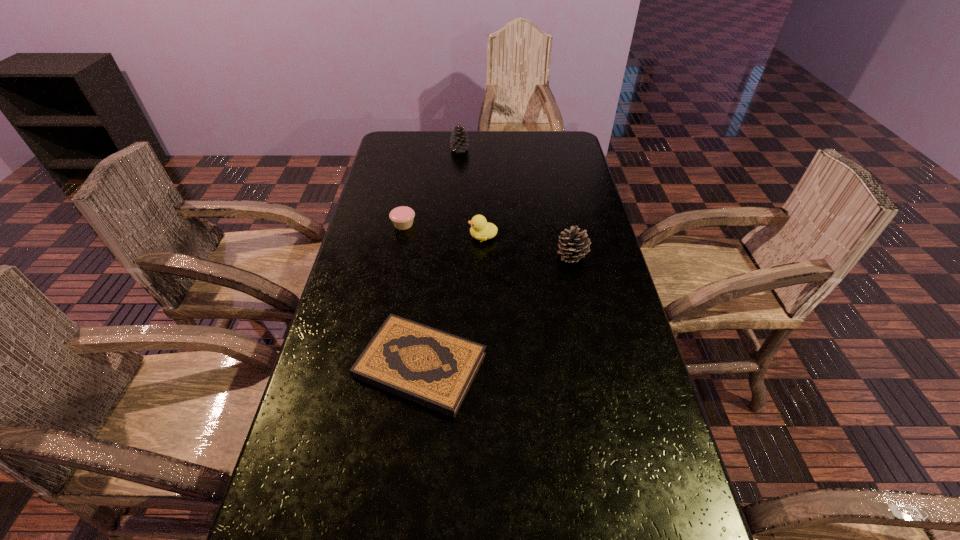
Locate an element on the screen. The height and width of the screenshot is (540, 960). the farthest object is located at coordinates (458, 143).

This screenshot has width=960, height=540. In order to click on the left pinecone in this screenshot , I will do `click(458, 143)`.

This screenshot has height=540, width=960. Identify the location of the nearer pinecone. [573, 246].

Where is `the rightmost object`? the rightmost object is located at coordinates (573, 246).

Image resolution: width=960 pixels, height=540 pixels. I want to click on duckling, so click(480, 229).

You are a GUI agent. You are given a task and a screenshot of the screen. Output one action in this format:
    pyautogui.click(x=<x>, y=<y>)
    Task: Click on the cupcake
    Image resolution: width=960 pixels, height=540 pixels.
    Given the screenshot: What is the action you would take?
    pyautogui.click(x=402, y=217)

At what (x,y) coordinates should I click in order to perform the action: click on hardback book. Please return your answer as a coordinate pair (x, y). Looking at the image, I should click on (430, 367).

Identify the location of the shortest object. (430, 367).

Find the location of a particular element. This screenshot has height=540, width=960. vacant space located 0.370m on the front of the farthest object is located at coordinates (456, 211).

Identify the location of vacant area situated on the back of the rightmost object. (x=557, y=183).